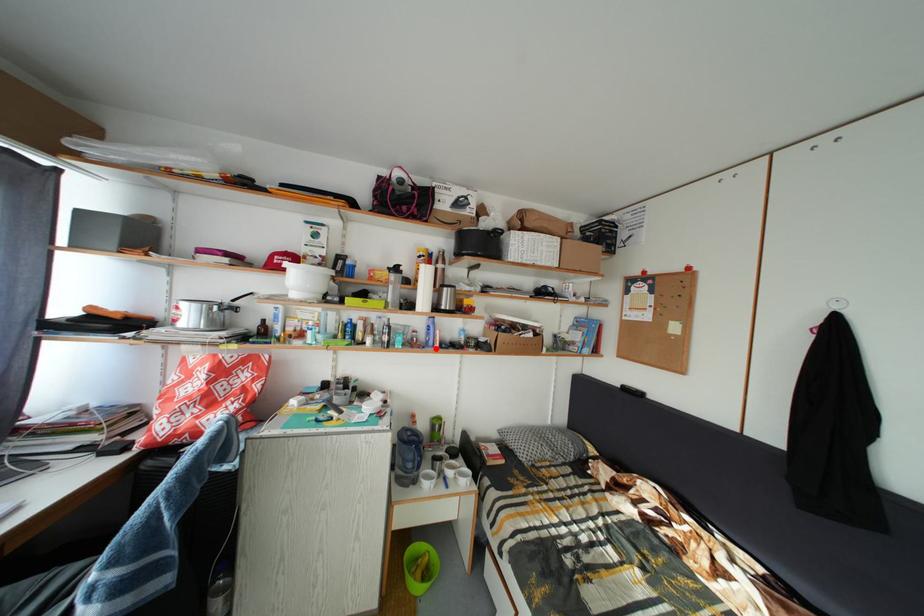
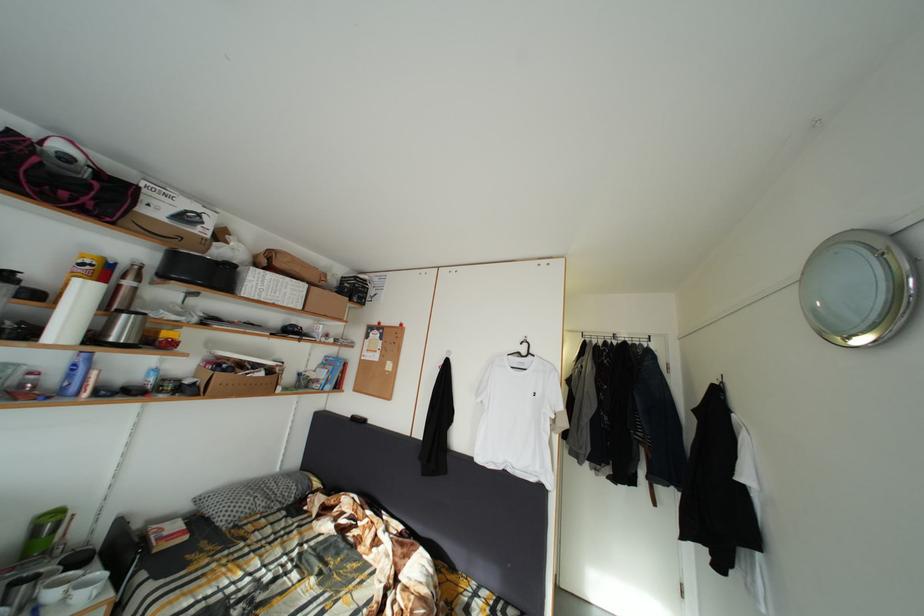
Question: I am providing you with two images of the same scene from different viewpoints. In image1, a red point is highlighted. Considering the same 3D point in image2, which of the following is correct?

Choices:
 (A) It is closer
 (B) It is farther

Answer: (A)